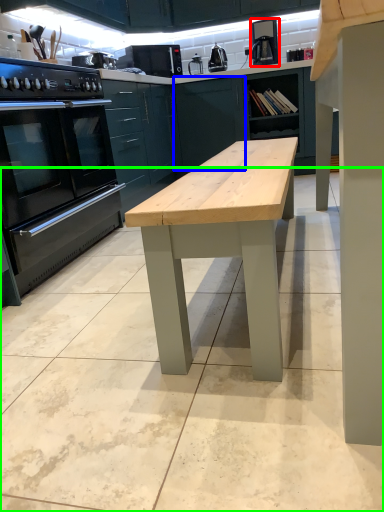
Question: Which is nearer to the coffee machine (highlighted by a red box)? cabinetry (highlighted by a blue box) or concrete (highlighted by a green box).

Choices:
 (A) cabinetry
 (B) concrete

Answer: (A)